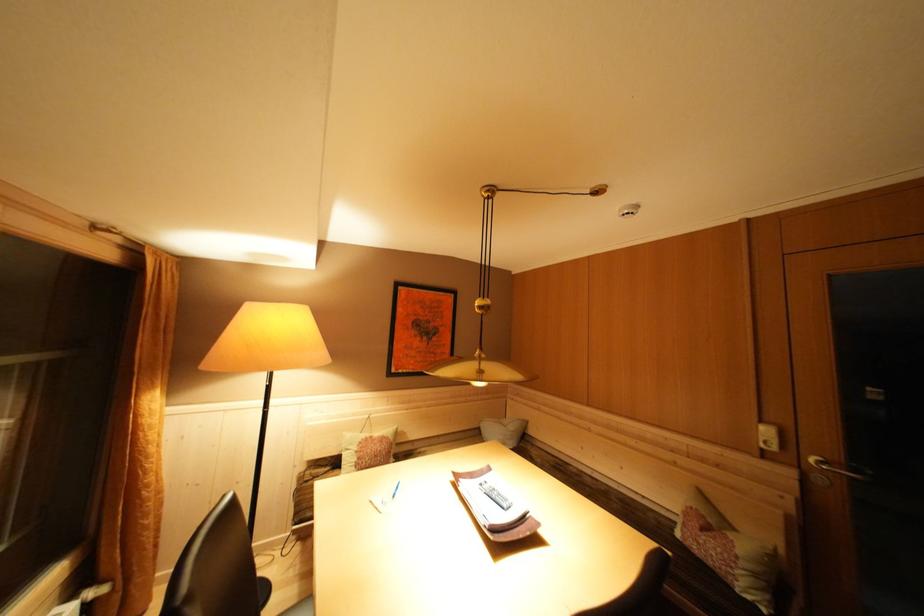
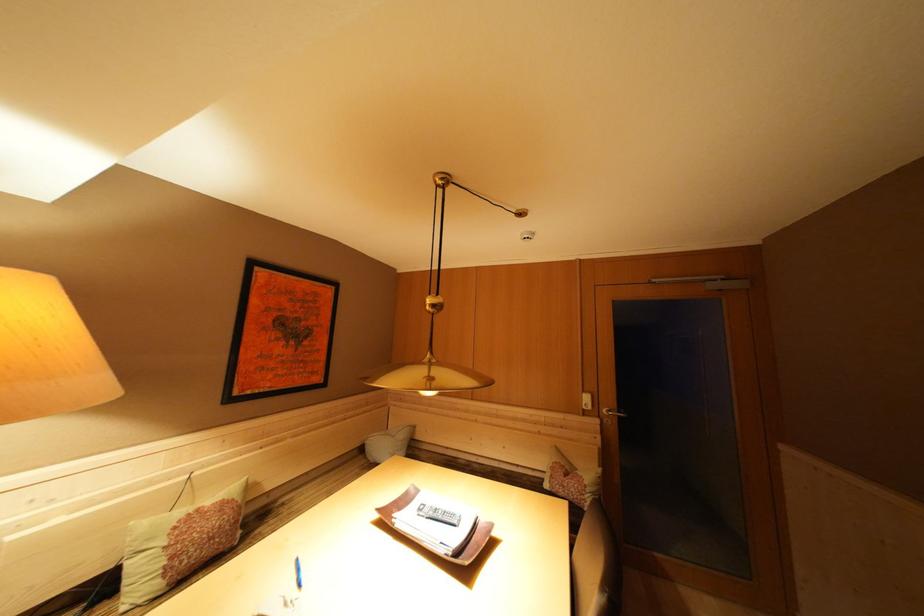
The point at [768,427] is marked in the first image. Where is the corresponding point in the second image?

(590, 397)